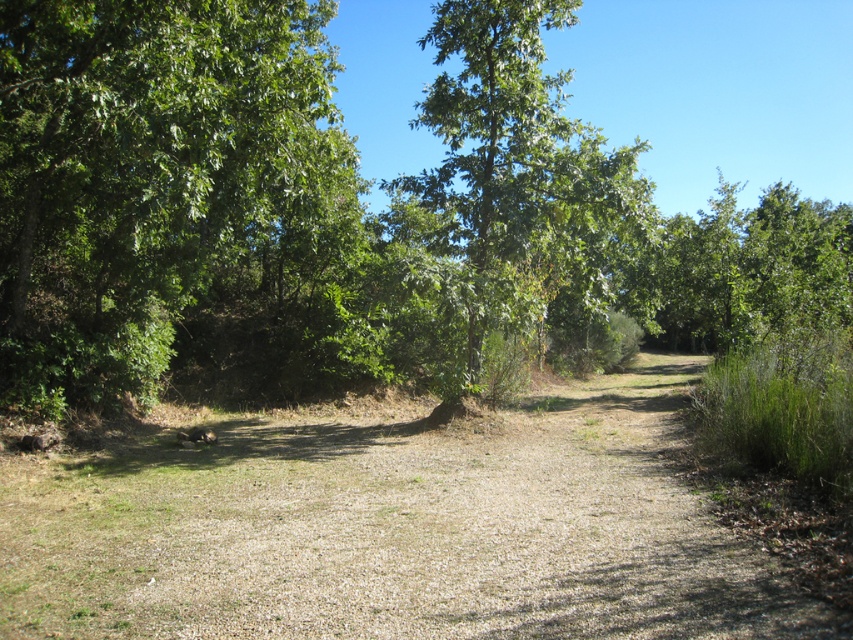
You are a hiker carrying a backpack and need to cross between the green leafy forest at center and the green leafy tree at left. The path is narrow, and your backpack adds an extra 0.5 meters to your width. What is the maximum width you can have to safely pass through the gap without touching either side?

The gap between the green leafy forest at center and the green leafy tree at left is 3.73 meters. Subtracting the 0.5 meters added by the backpack, the maximum width you can have is 3.73 meters minus 0.5 meters, which equals 3.23 meters. Therefore, to safely pass through the gap without touching either side, your total width must not exceed 3.23 meters.

You are a hiker walking along the dirt path in the park. You notice two green leafy trees ahead. One is labeled as the green leafy tree at left and the other as the green leafy tree at center. Which tree would you see first as you continue walking along the path?

The green leafy tree at left would be seen first because it is positioned on the left side of the green leafy tree at center, meaning it is closer to the path from the left direction.

You are a hiker planning to take a photo of the green leafy forest at center and the green leafy tree at left from a distance. Which one would appear bigger in your photo?

The green leafy forest at center would appear bigger in the photo because it has a larger size compared to the green leafy tree at left.